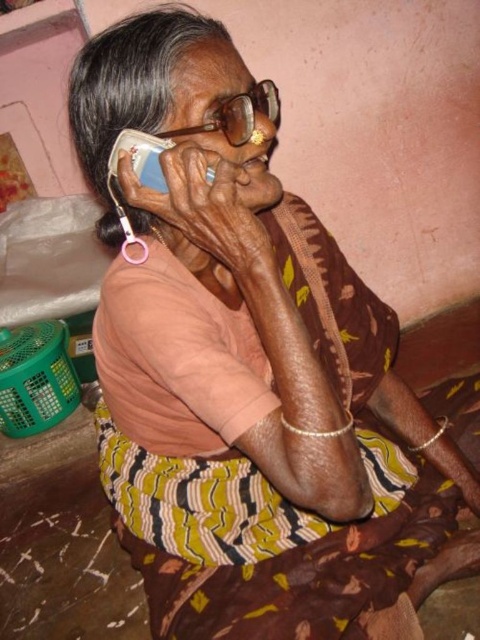
Question: Observing the image, what is the correct spatial positioning of gold textured glasses at center in reference to white plastic phone at upper left?

Choices:
 (A) left
 (B) right

Answer: (B)

Question: Among these points, which one is nearest to the camera?

Choices:
 (A) (202, 129)
 (B) (155, 189)

Answer: (A)

Question: Does gold textured glasses at center appear on the left side of white plastic phone at upper left?

Choices:
 (A) no
 (B) yes

Answer: (A)

Question: Which object is farther from the camera taking this photo?

Choices:
 (A) white plastic phone at upper left
 (B) gold textured glasses at center

Answer: (B)

Question: Does gold textured glasses at center have a larger size compared to white plastic phone at upper left?

Choices:
 (A) no
 (B) yes

Answer: (B)